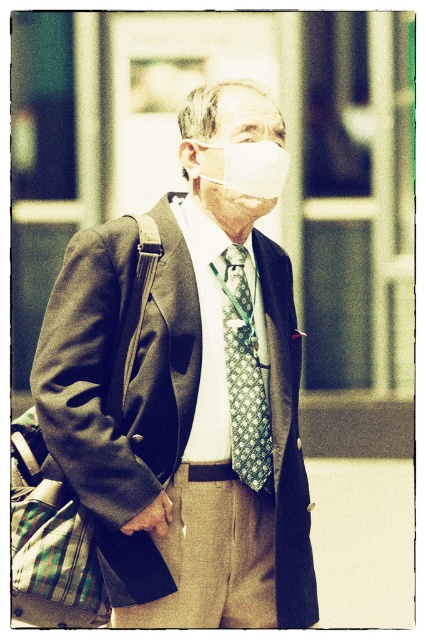
You are a photographer trying to capture a portrait of the man. You notice the white matte mask at center and the green patterned tie at center. Which object is shorter in height?

The white matte mask at center is shorter in height than the green patterned tie at center.